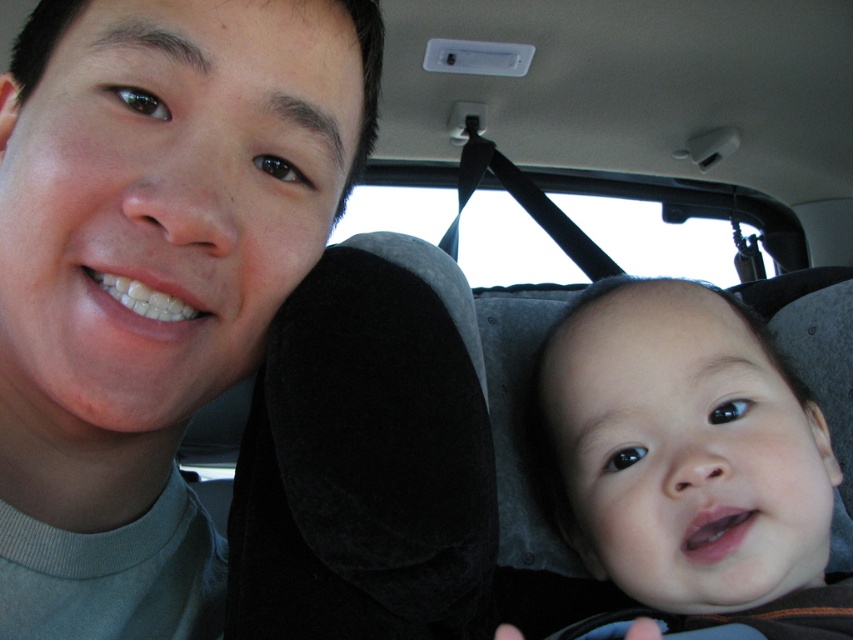
Can you confirm if matte gray headrest at left is taller than smooth skin baby at right?

Yes, matte gray headrest at left is taller than smooth skin baby at right.

Which is in front, point (167, 99) or point (584, 518)?

Point (167, 99)

Identify the location of matte gray headrest at left. (152, 276).